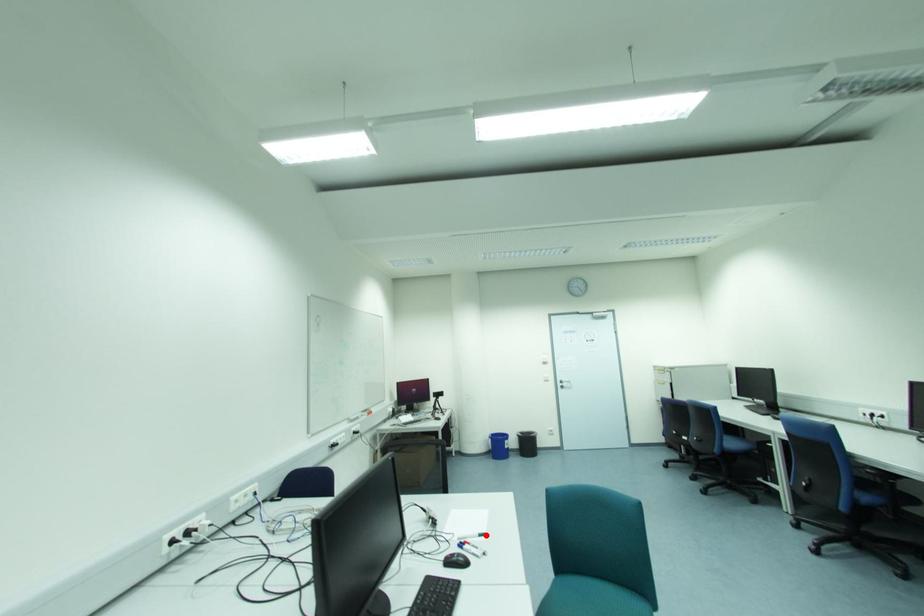
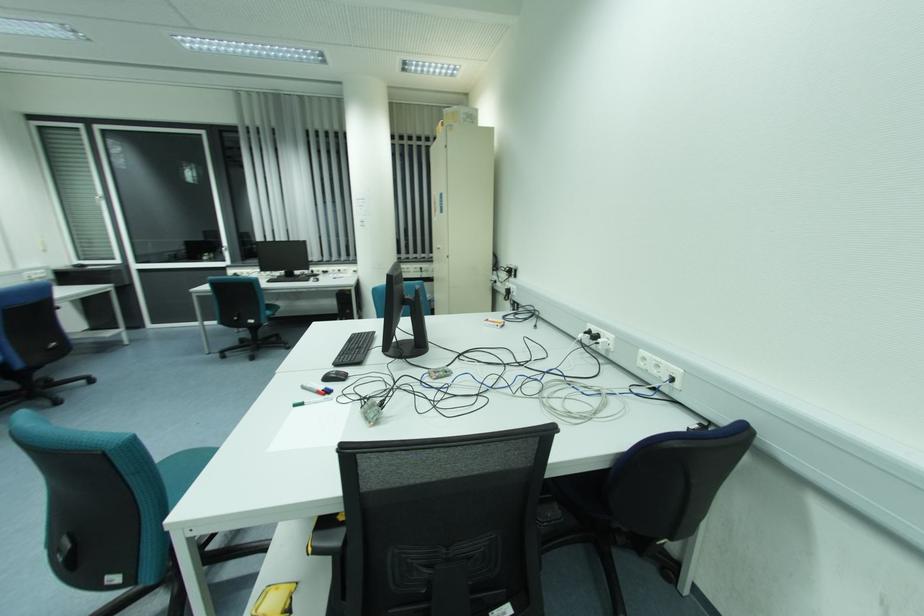
Find the pixel in the second image that matches the highlighted location in the first image.

(296, 406)